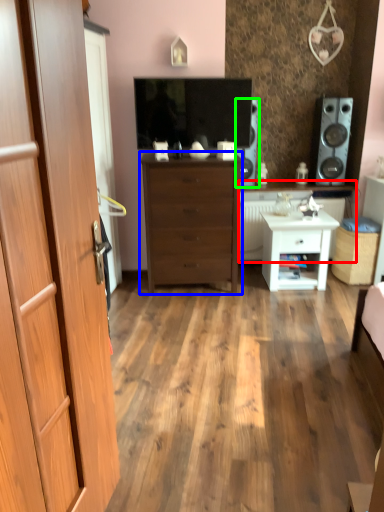
Question: Which object is positioned farthest from counter top (highlighted by a red box)? Select from chest of drawers (highlighted by a blue box) and speaker (highlighted by a green box).

Choices:
 (A) chest of drawers
 (B) speaker

Answer: (A)